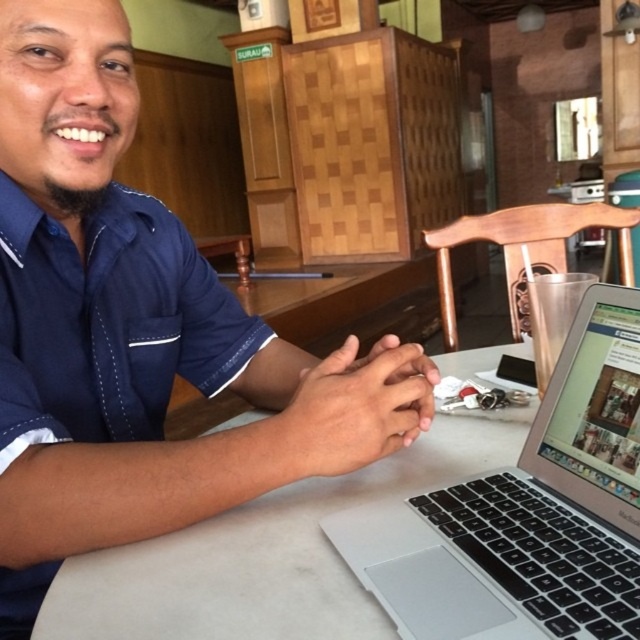
Is point (388, 401) less distant than point (604, 525)?

No.

Can you confirm if blue fabric shirt at center is positioned to the right of silver metallic laptop at center?

In fact, blue fabric shirt at center is to the left of silver metallic laptop at center.

What are the coordinates of `blue fabric shirt at center` in the screenshot? It's located at (138, 330).

Between point (122, 208) and point (12, 602), which one is positioned behind?

The point (122, 208) is more distant.

Does blue fabric shirt at center have a larger size compared to navy blue fabric shirt at center?

Yes, blue fabric shirt at center is bigger than navy blue fabric shirt at center.

Who is more distant from viewer, (100, 220) or (188, 257)?

The point (188, 257) is more distant.

Locate an element on the screen. This screenshot has height=640, width=640. blue fabric shirt at center is located at coordinates (138, 330).

Which is below, navy blue fabric shirt at center or white matte table at center?

white matte table at center is below.

Who is more forward, (83,355) or (204,598)?

Point (204,598) is in front.

Find the location of a particular element. navy blue fabric shirt at center is located at coordinates (99, 376).